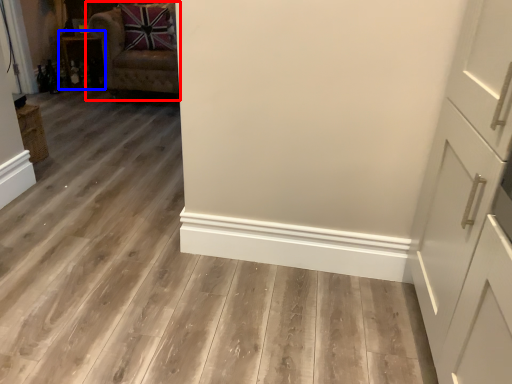
Question: Which object appears farthest to the camera in this image, chair (highlighted by a red box) or cabinetry (highlighted by a blue box)?

Choices:
 (A) chair
 (B) cabinetry

Answer: (B)